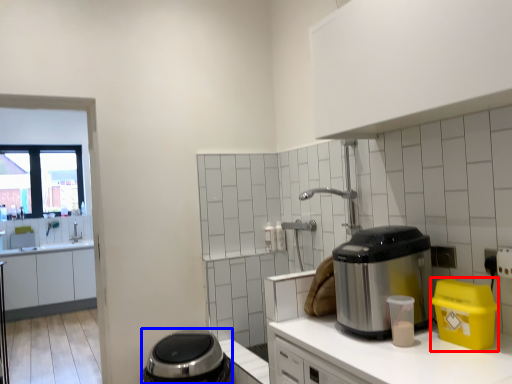
Question: Which object is further to the camera taking this photo, appliance (highlighted by a red box) or appliance (highlighted by a blue box)?

Choices:
 (A) appliance
 (B) appliance

Answer: (B)